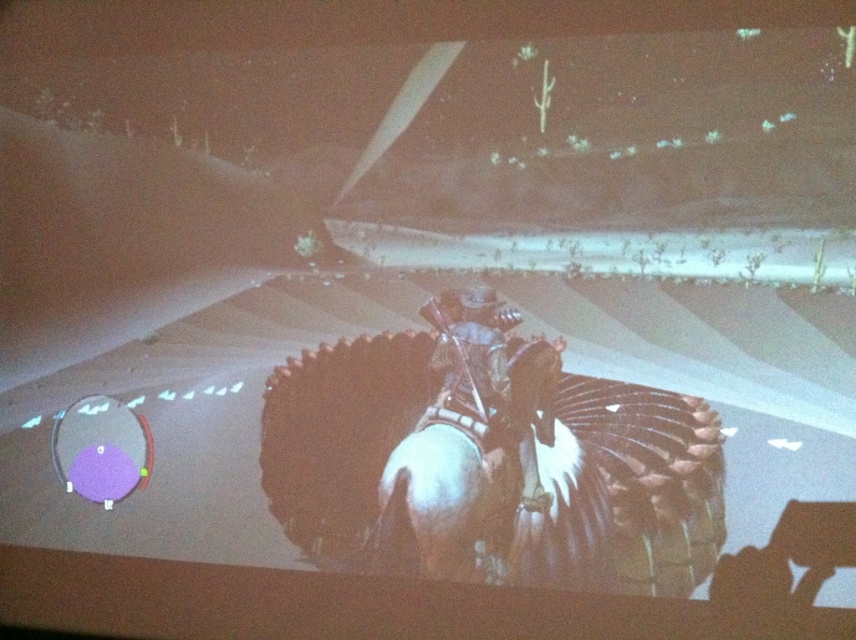
Question: Is white matte horse at center below metallic armor at center?

Choices:
 (A) yes
 (B) no

Answer: (A)

Question: Which of the following is the farthest from the observer?

Choices:
 (A) metallic armor at center
 (B) white matte horse at center

Answer: (B)

Question: Is white matte horse at center behind metallic armor at center?

Choices:
 (A) no
 (B) yes

Answer: (B)

Question: Can you confirm if white matte horse at center is positioned above metallic armor at center?

Choices:
 (A) yes
 (B) no

Answer: (B)

Question: Which of the following is the closest to the observer?

Choices:
 (A) white matte horse at center
 (B) metallic armor at center

Answer: (B)